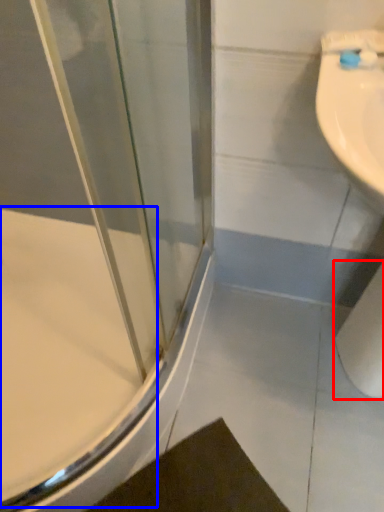
Question: Among these objects, which one is nearest to the camera, toilet paper (highlighted by a red box) or bath (highlighted by a blue box)?

Choices:
 (A) toilet paper
 (B) bath

Answer: (A)